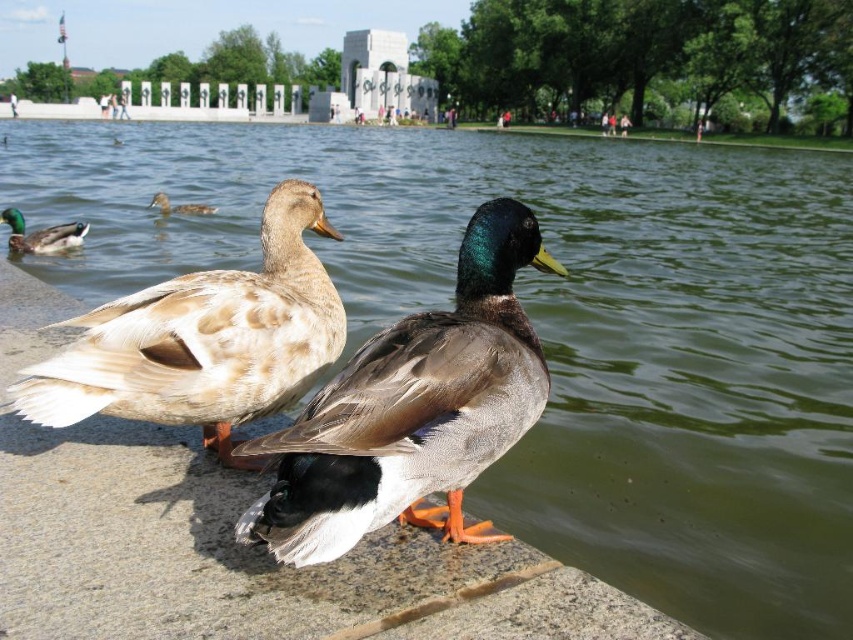
Can you confirm if shiny brown duck at center is shorter than brown feathered duck at center?

Yes, shiny brown duck at center is shorter than brown feathered duck at center.

This screenshot has height=640, width=853. I want to click on shiny brown duck at center, so click(x=412, y=410).

The width and height of the screenshot is (853, 640). Find the location of `shiny brown duck at center`. shiny brown duck at center is located at coordinates (412, 410).

Identify the location of shiny brown duck at center. The height and width of the screenshot is (640, 853). (412, 410).

Is brown feathered duck at center positioned behind brown matte duck at upper left?

No.

Between point (248, 404) and point (192, 211), which one is positioned behind?

The point (192, 211) is behind.

Who is more distant from viewer, (291, 353) or (180, 208)?

Positioned behind is point (180, 208).

The width and height of the screenshot is (853, 640). I want to click on brown feathered duck at center, so click(x=202, y=339).

This screenshot has height=640, width=853. Describe the element at coordinates (412, 410) in the screenshot. I see `shiny brown duck at center` at that location.

What do you see at coordinates (412, 410) in the screenshot? The width and height of the screenshot is (853, 640). I see `shiny brown duck at center` at bounding box center [412, 410].

Locate an element on the screen. The width and height of the screenshot is (853, 640). shiny brown duck at center is located at coordinates (412, 410).